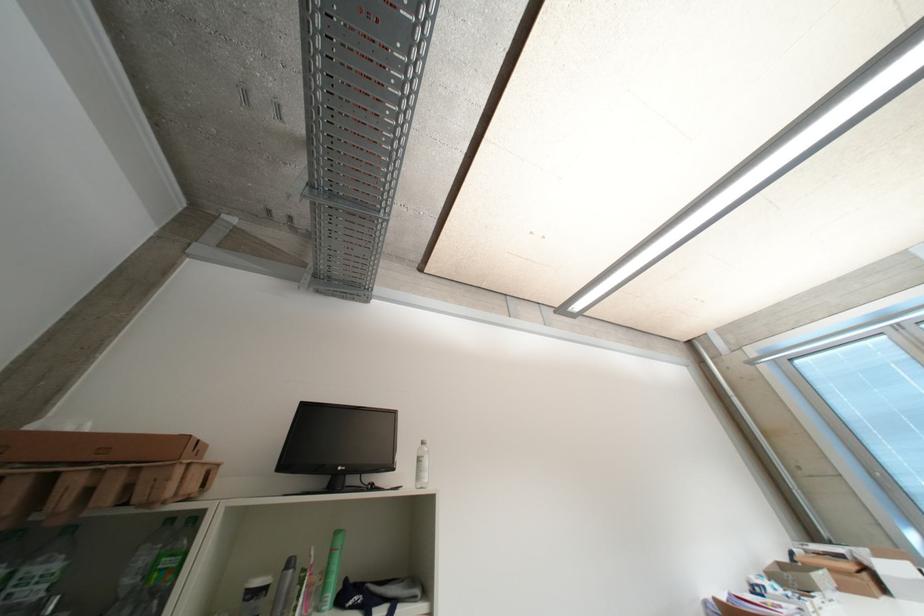
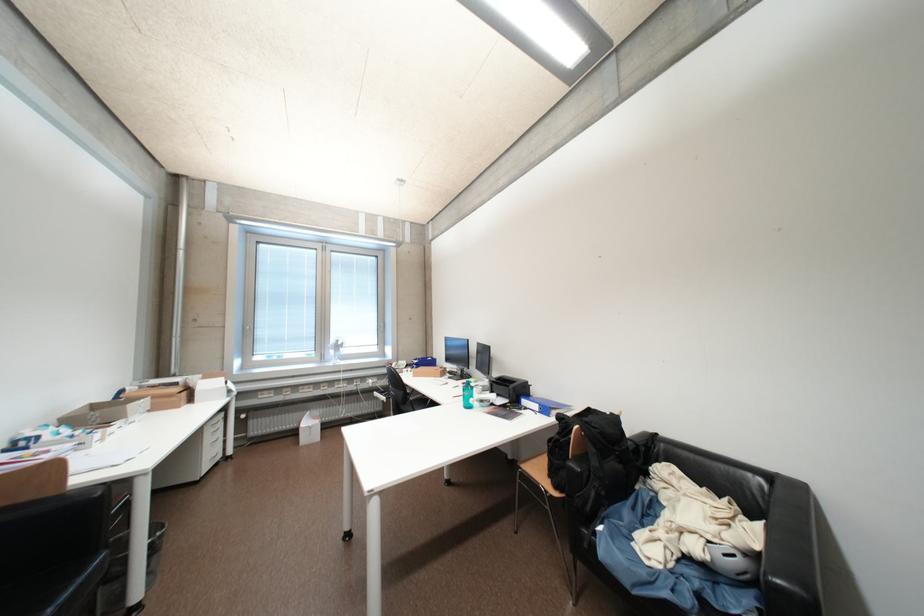
Question: I am providing you with two images of the same scene from different viewpoints. Please identify which objects are invisible in image2.

Choices:
 (A) cardboard box
 (B) sofa sitting surface
 (C) small white fan
 (D) none of these

Answer: (D)